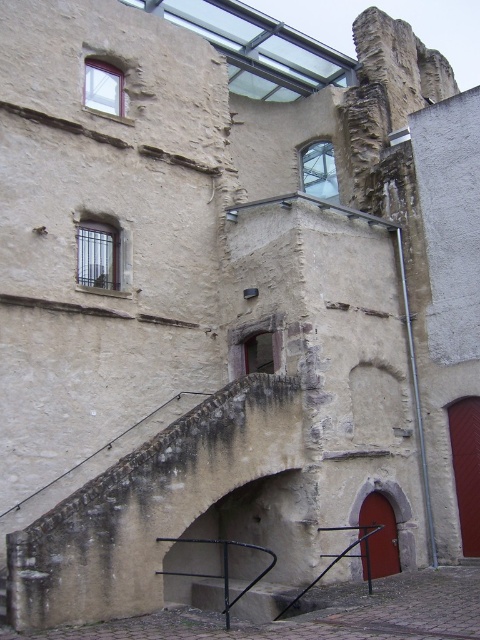
Between black metal/rail at lower center and black metal rail at lower center, which one is positioned higher?

black metal/rail at lower center is above.

Is black metal/rail at lower center bigger than black metal rail at lower center?

Correct, black metal/rail at lower center is larger in size than black metal rail at lower center.

Which is in front, point (190, 538) or point (356, 556)?

Point (356, 556) is more forward.

The width and height of the screenshot is (480, 640). Identify the location of black metal/rail at lower center. (223, 566).